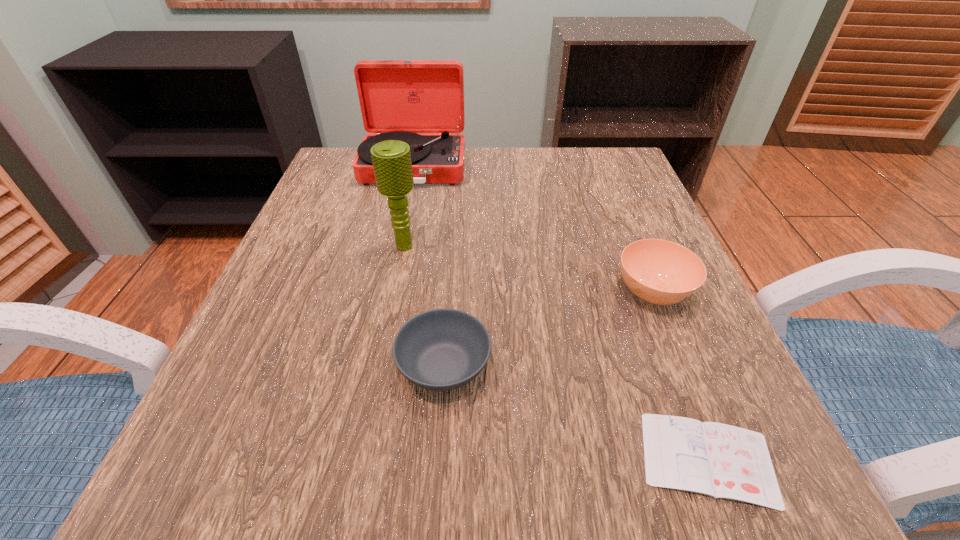
The image size is (960, 540). I want to click on vacant space located on the front of the third farthest object, so click(738, 504).

Find the location of a particular element. The height and width of the screenshot is (540, 960). free space located on the back of the nearer soup bowl is located at coordinates (453, 234).

Where is `vacant space located on the back of the diary`? vacant space located on the back of the diary is located at coordinates (626, 246).

At what (x,y) coordinates should I click in order to perform the action: click on object present at the far edge. Please return your answer as a coordinate pair (x, y). The height and width of the screenshot is (540, 960). Looking at the image, I should click on (398, 98).

Where is `object that is at the near edge`? object that is at the near edge is located at coordinates (723, 461).

Locate an element on the screen. Image resolution: width=960 pixels, height=540 pixels. object that is at the left edge is located at coordinates (398, 98).

Locate an element on the screen. The image size is (960, 540). soup bowl at the right edge is located at coordinates (661, 272).

In order to click on diary at the right edge in this screenshot , I will do `click(723, 461)`.

Where is `object that is at the far left corner`? object that is at the far left corner is located at coordinates (398, 98).

Identify the location of object present at the near right corner. This screenshot has height=540, width=960. pos(723,461).